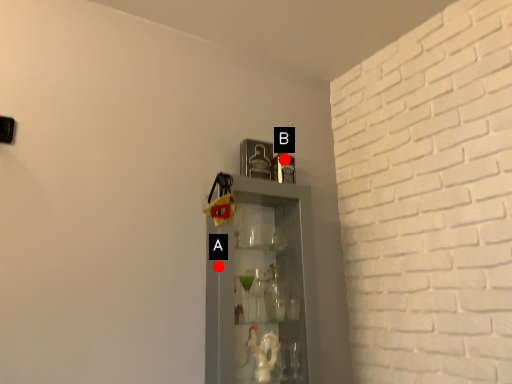
Question: Two points are circled on the image, labeled by A and B beside each circle. Which of the following is the closest to the observer?

Choices:
 (A) A is closer
 (B) B is closer

Answer: (A)